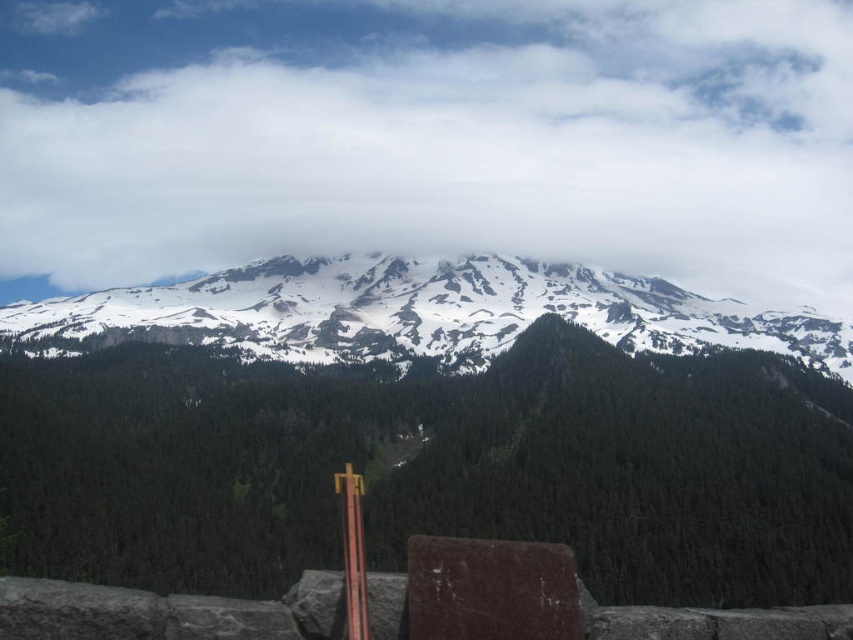
Who is lower down, white snow-covered mountain at upper center or brown rough stone at center?

brown rough stone at center is lower down.

Between point (782, 321) and point (474, 589), which one is positioned behind?

The point (782, 321) is behind.

Find the location of `white snow-covered mountain at upper center`. white snow-covered mountain at upper center is located at coordinates (415, 310).

Does point (47, 243) come in front of point (352, 284)?

No, it is behind (352, 284).

Does white fluffy cloud at upper center have a smaller size compared to white snow-covered mountain at upper center?

Incorrect, white fluffy cloud at upper center is not smaller in size than white snow-covered mountain at upper center.

Between point (483, 186) and point (372, 348), which one is positioned in front?

Point (372, 348)

The image size is (853, 640). I want to click on white fluffy cloud at upper center, so click(430, 136).

Is snowy rock at upper center positioned before white snow-covered mountain at upper center?

Yes, snowy rock at upper center is closer to the viewer.

Does snowy rock at upper center have a greater height compared to white snow-covered mountain at upper center?

Indeed, snowy rock at upper center has a greater height compared to white snow-covered mountain at upper center.

Which is in front, point (734, 353) or point (407, 339)?

Positioned in front is point (734, 353).

At what (x,y) coordinates should I click in order to perform the action: click on snowy rock at upper center. Please return your answer as a coordinate pair (x, y). This screenshot has height=640, width=853. Looking at the image, I should click on (427, 428).